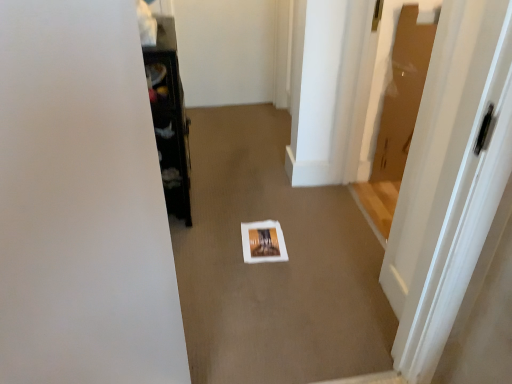
Question: Should I look upward or downward to see black glossy cabinet at left?

Choices:
 (A) down
 (B) up

Answer: (B)

Question: Can you confirm if white glossy door at center right is taller than white paper at center?

Choices:
 (A) yes
 (B) no

Answer: (A)

Question: Does white glossy door at center right have a lesser height compared to white paper at center?

Choices:
 (A) no
 (B) yes

Answer: (A)

Question: From the image's perspective, is white glossy door at center right over white paper at center?

Choices:
 (A) no
 (B) yes

Answer: (B)

Question: Considering the relative sizes of white glossy door at center right and white paper at center in the image provided, is white glossy door at center right wider than white paper at center?

Choices:
 (A) no
 (B) yes

Answer: (A)

Question: From a real-world perspective, is white glossy door at center right on white paper at center?

Choices:
 (A) yes
 (B) no

Answer: (A)

Question: Can you confirm if white glossy door at center right is smaller than white paper at center?

Choices:
 (A) no
 (B) yes

Answer: (A)

Question: Is black glossy cabinet at left at the left side of white glossy door at center right?

Choices:
 (A) yes
 (B) no

Answer: (A)

Question: From a real-world perspective, is black glossy cabinet at left located higher than white glossy door at center right?

Choices:
 (A) yes
 (B) no

Answer: (B)

Question: Could white glossy door at center right be considered to be inside black glossy cabinet at left?

Choices:
 (A) yes
 (B) no

Answer: (B)

Question: Considering the relative sizes of black glossy cabinet at left and white glossy door at center right in the image provided, is black glossy cabinet at left shorter than white glossy door at center right?

Choices:
 (A) no
 (B) yes

Answer: (B)

Question: Is black glossy cabinet at left behind white glossy door at center right?

Choices:
 (A) yes
 (B) no

Answer: (A)

Question: Can we say black glossy cabinet at left lies outside white glossy door at center right?

Choices:
 (A) no
 (B) yes

Answer: (B)

Question: Could you tell me if white paper at center is turned towards white glossy door at center right?

Choices:
 (A) yes
 (B) no

Answer: (B)